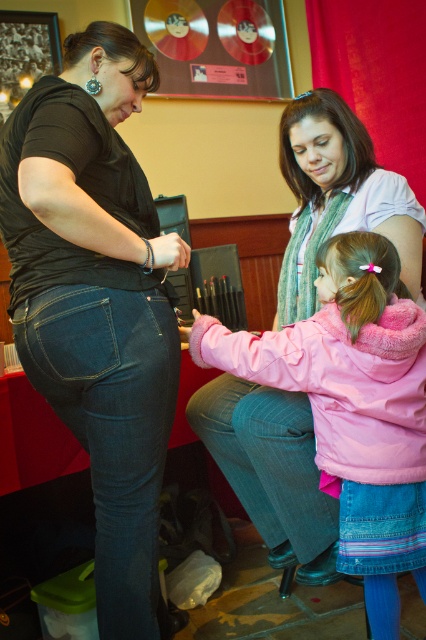
Question: Can you confirm if black matte jeans at center is positioned to the left of light brown silky hair at center?

Choices:
 (A) no
 (B) yes

Answer: (B)

Question: Considering the real-world distances, which object is closest to the pink fleece jacket at center?

Choices:
 (A) dark brown shiny hair at upper left
 (B) light brown silky hair at center
 (C) black matte jeans at center
 (D) brown smooth hair at center

Answer: (B)

Question: Is pink fleece jacket at center closer to camera compared to dark brown shiny hair at upper left?

Choices:
 (A) yes
 (B) no

Answer: (A)

Question: Which point is closer to the camera?

Choices:
 (A) black matte jeans at center
 (B) brown smooth hair at center
 (C) pink fleece jacket at center
 (D) light brown silky hair at center

Answer: (A)

Question: Is black matte jeans at center further to the viewer compared to pink fleece jacket at center?

Choices:
 (A) no
 (B) yes

Answer: (A)

Question: Which object is the closest to the pink fleece jacket at center?

Choices:
 (A) dark brown shiny hair at upper left
 (B) light brown silky hair at center

Answer: (B)